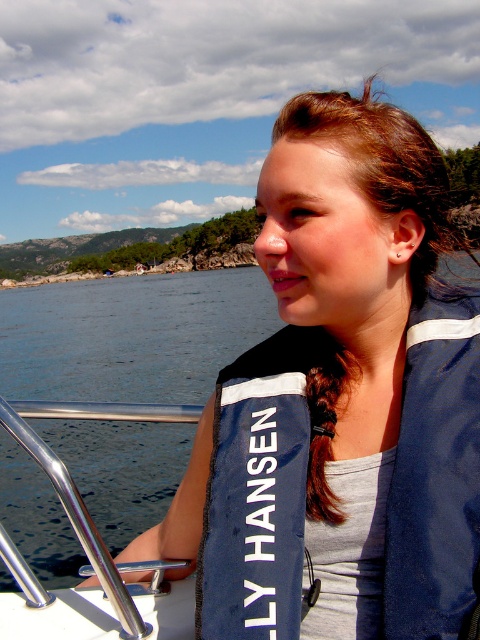
Consider the image. Can you confirm if navy blue fabric life jacket at center is smaller than brushed metal railing at lower left?

Yes, navy blue fabric life jacket at center is smaller than brushed metal railing at lower left.

Between point (272, 397) and point (164, 412), which one is positioned in front?

Point (272, 397) is more forward.

Image resolution: width=480 pixels, height=640 pixels. In order to click on navy blue fabric life jacket at center in this screenshot , I will do `click(260, 490)`.

From the picture: Does navy blue life vest at center come behind brushed metal railing at lower left?

No, navy blue life vest at center is closer to the viewer.

Between navy blue life vest at center and brushed metal railing at lower left, which one is positioned higher?

navy blue life vest at center

Locate an element on the screen. The image size is (480, 640). navy blue life vest at center is located at coordinates (343, 394).

At what (x,y) coordinates should I click in order to perform the action: click on navy blue life vest at center. Please return your answer as a coordinate pair (x, y). Looking at the image, I should click on (343, 394).

Can you confirm if navy blue life vest at center is thinner than navy blue fabric life jacket at center?

In fact, navy blue life vest at center might be wider than navy blue fabric life jacket at center.

From the picture: Is navy blue life vest at center closer to camera compared to navy blue fabric life jacket at center?

No, it is behind navy blue fabric life jacket at center.

Who is more forward, (310, 470) or (225, 499)?

Point (310, 470) is more forward.

The width and height of the screenshot is (480, 640). What are the coordinates of `navy blue life vest at center` in the screenshot? It's located at point(343,394).